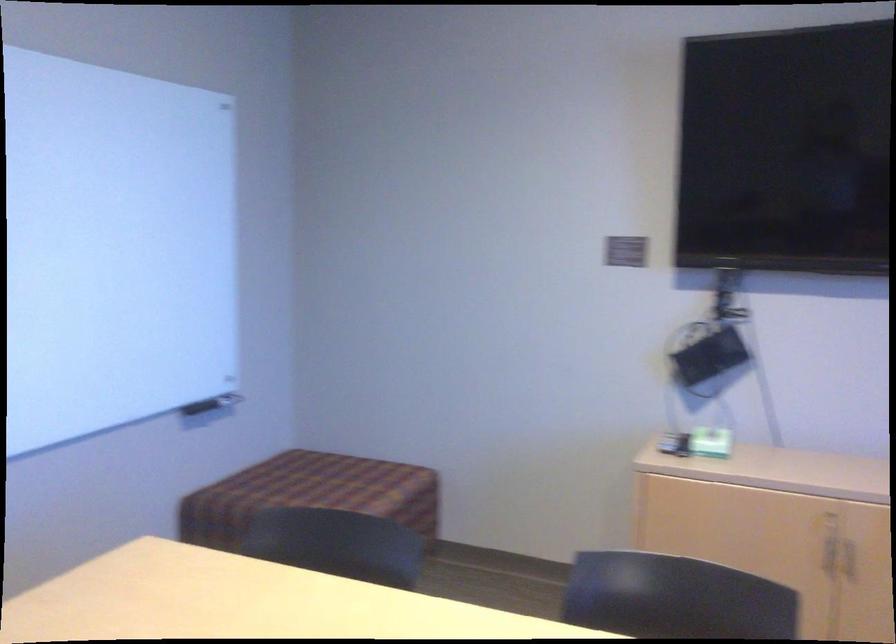
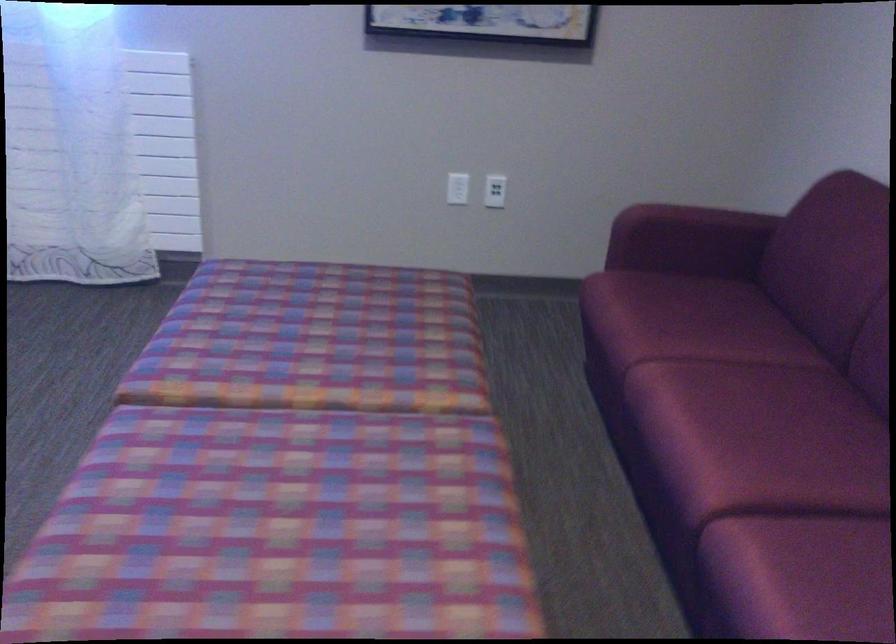
How did the camera likely rotate?

The camera rotated toward right-down.